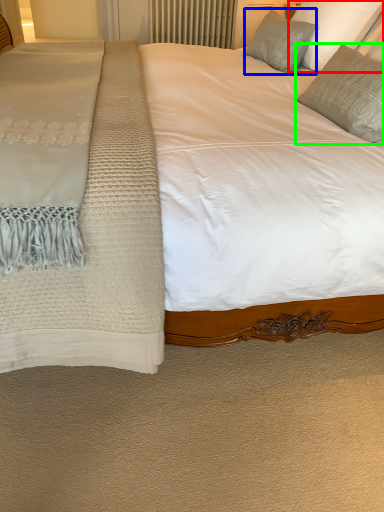
Question: Considering the real-world distances, which object is closest to pillow (highlighted by a red box)? pillow (highlighted by a blue box) or pillow (highlighted by a green box).

Choices:
 (A) pillow
 (B) pillow

Answer: (A)